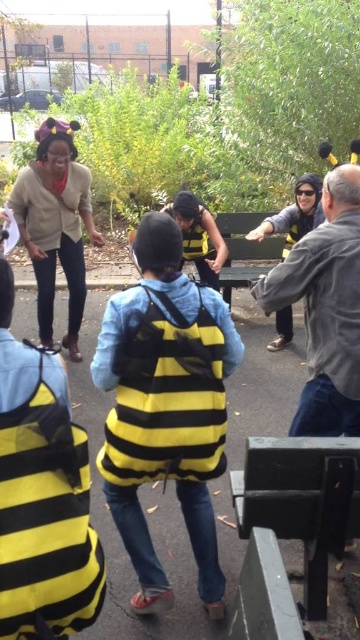
Is yellow and black costume at center thinner than wooden park bench at center?

Correct, yellow and black costume at center's width is less than wooden park bench at center's.

Between yellow and black costume at center and wooden park bench at center, which one has more height?

wooden park bench at center

Does point (276, 225) lie behind point (223, 266)?

No, (276, 225) is in front of (223, 266).

This screenshot has height=640, width=360. I want to click on yellow and black costume at center, so click(x=294, y=214).

Is gray woolen jacket at upper right bigger than metallic silver picnic table at lower center?

Yes.

Measure the distance between gray woolen jacket at upper right and camera.

gray woolen jacket at upper right is 6.89 feet away from camera.

Where is `gray woolen jacket at upper right`? This screenshot has height=640, width=360. gray woolen jacket at upper right is located at coordinates (326, 308).

Which is more to the right, metallic silver picnic table at lower center or wooden park bench at center?

wooden park bench at center is more to the right.

Between metallic silver picnic table at lower center and wooden park bench at center, which one has more height?

Standing taller between the two is wooden park bench at center.

Where is `metallic silver picnic table at lower center`? metallic silver picnic table at lower center is located at coordinates (302, 500).

In order to click on metallic silver picnic table at lower center in this screenshot , I will do `click(302, 500)`.